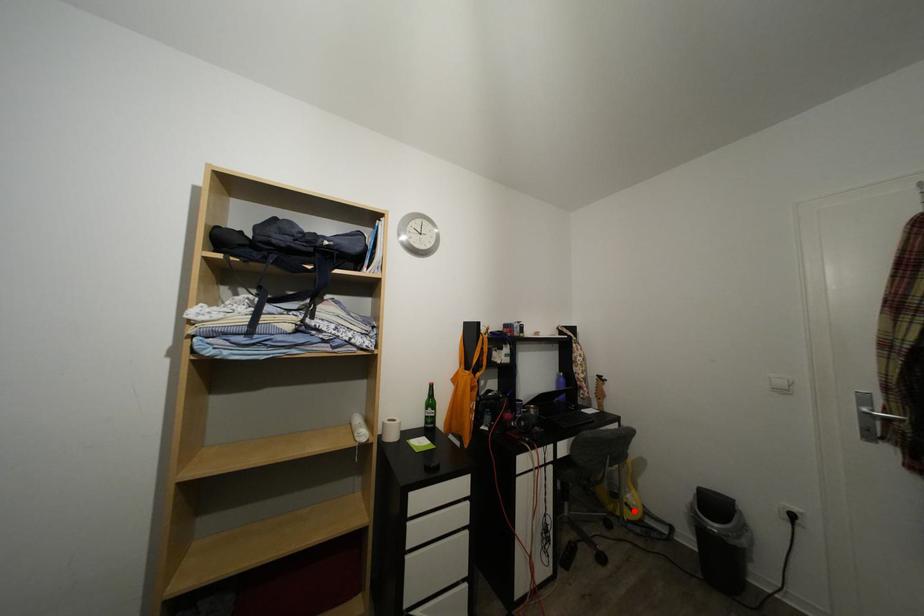
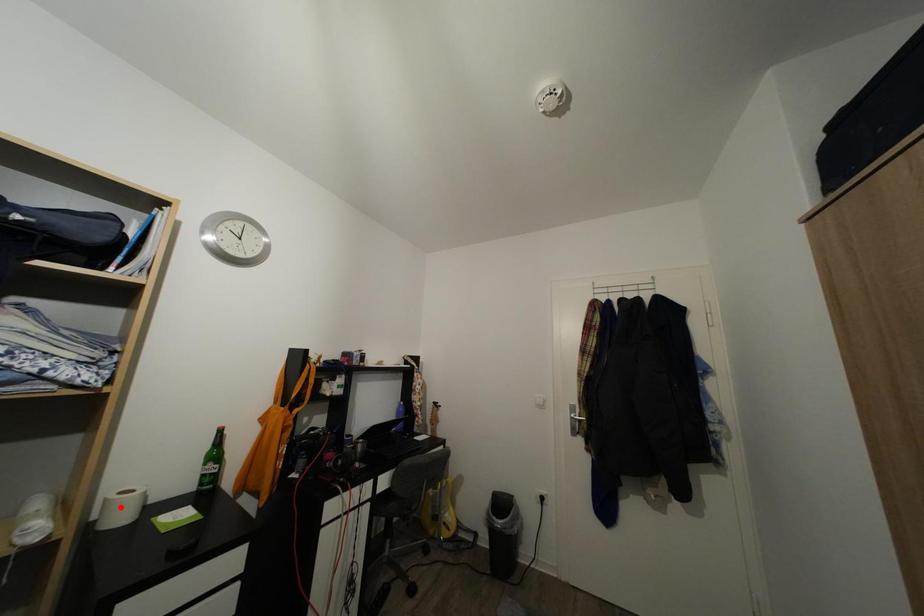
I am providing you with two images of the same scene from different viewpoints. A red point is marked on the first image and another point is marked on the second image. Is the red point in image1 aligned with the point shown in image2?

No